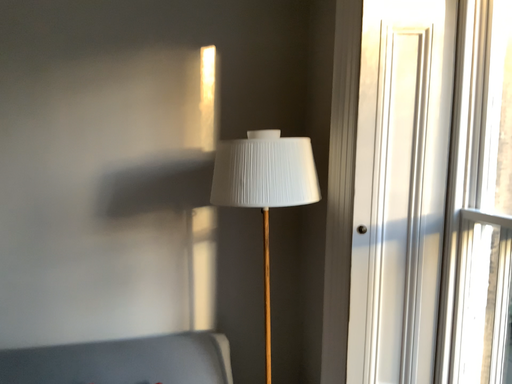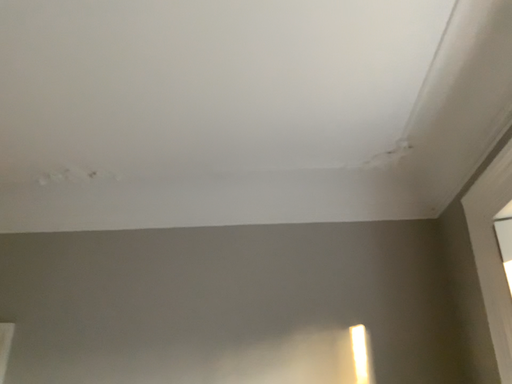
Question: How did the camera likely rotate when shooting the video?

Choices:
 (A) rotated left
 (B) rotated right

Answer: (A)